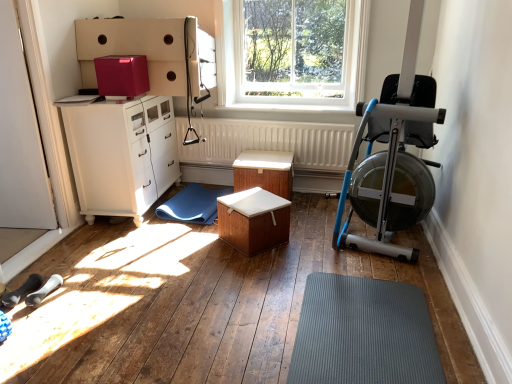
Question: Is glossy cardboard box at upper center smaller than gray rubber mat at lower center, the first doormat positioned from the right?

Choices:
 (A) yes
 (B) no

Answer: (A)

Question: From the image's perspective, is glossy cardboard box at upper center located above gray rubber mat at lower center, the 2th doormat from the left?

Choices:
 (A) no
 (B) yes

Answer: (B)

Question: Does glossy cardboard box at upper center have a lesser width compared to gray rubber mat at lower center, the first doormat positioned from the right?

Choices:
 (A) yes
 (B) no

Answer: (A)

Question: Is glossy cardboard box at upper center aimed at gray rubber mat at lower center, acting as the first doormat starting from the bottom?

Choices:
 (A) no
 (B) yes

Answer: (A)

Question: Does glossy cardboard box at upper center contain gray rubber mat at lower center, arranged as the second doormat when viewed from the back?

Choices:
 (A) no
 (B) yes

Answer: (A)

Question: Do you think white textured radiator at center is within silver metallic rowing machine at right, or outside of it?

Choices:
 (A) inside
 (B) outside

Answer: (B)

Question: Considering the positions of white textured radiator at center and silver metallic rowing machine at right in the image, is white textured radiator at center taller or shorter than silver metallic rowing machine at right?

Choices:
 (A) short
 (B) tall

Answer: (A)

Question: From the image's perspective, is white textured radiator at center located above or below silver metallic rowing machine at right?

Choices:
 (A) below
 (B) above

Answer: (A)

Question: From a real-world perspective, is white textured radiator at center above or below silver metallic rowing machine at right?

Choices:
 (A) below
 (B) above

Answer: (A)

Question: Relative to white glossy screen door at lower left, is blue rubber mat at center, marked as the 1th doormat in a back-to-front arrangement, in front or behind?

Choices:
 (A) front
 (B) behind

Answer: (B)

Question: Looking at the image, does blue rubber mat at center, which is the first doormat in top-to-bottom order, seem bigger or smaller compared to white glossy screen door at lower left?

Choices:
 (A) small
 (B) big

Answer: (A)

Question: Choose the correct answer: Is blue rubber mat at center, which is the 2th doormat from front to back, inside white glossy screen door at lower left or outside it?

Choices:
 (A) inside
 (B) outside

Answer: (B)

Question: From a real-world perspective, is blue rubber mat at center, which is the 2th doormat from front to back, above or below white glossy screen door at lower left?

Choices:
 (A) above
 (B) below

Answer: (B)

Question: Looking at their shapes, would you say white glossy cabinet at left is wider or thinner than silver metallic rowing machine at right?

Choices:
 (A) thin
 (B) wide

Answer: (A)

Question: Is point (98, 102) closer or farther from the camera than point (387, 132)?

Choices:
 (A) closer
 (B) farther

Answer: (B)